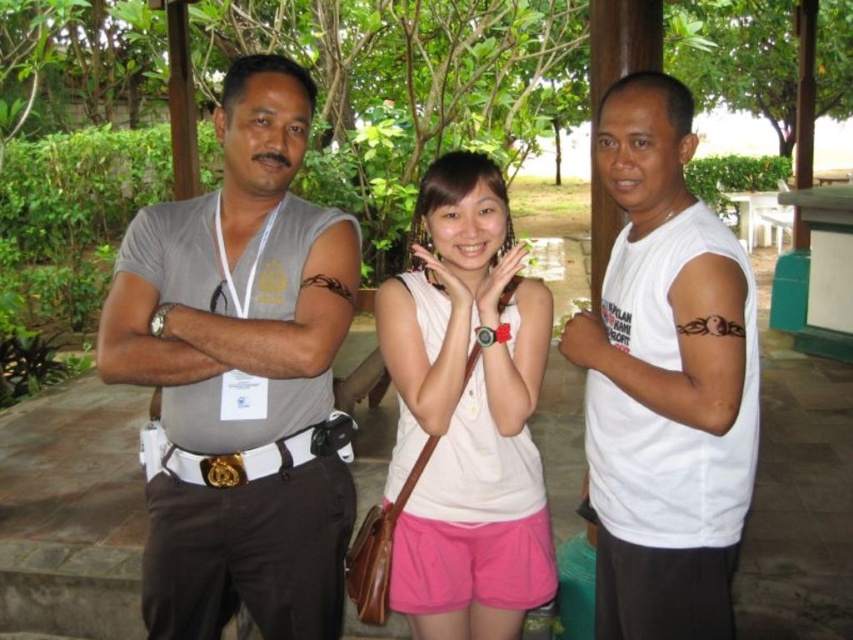
Find the location of a particular element. The width and height of the screenshot is (853, 640). gray matte t-shirt at left is located at coordinates (241, 372).

Is gray matte t-shirt at left in front of white matte t-shirt at center?

No.

Does point (303, 468) come behind point (659, 456)?

Yes, it is behind point (659, 456).

Locate an element on the screen. gray matte t-shirt at left is located at coordinates (241, 372).

Does white matte t-shirt at center appear under white matte tank top at center?

No, white matte t-shirt at center is not below white matte tank top at center.

Can you confirm if white matte t-shirt at center is wider than white matte tank top at center?

No.

This screenshot has width=853, height=640. Describe the element at coordinates (665, 381) in the screenshot. I see `white matte t-shirt at center` at that location.

Where is `white matte t-shirt at center`? The width and height of the screenshot is (853, 640). white matte t-shirt at center is located at coordinates (665, 381).

Can you confirm if gray matte t-shirt at left is wider than white matte tank top at center?

Indeed, gray matte t-shirt at left has a greater width compared to white matte tank top at center.

Who is more forward, (334, 605) or (519, 458)?

Positioned in front is point (334, 605).

Locate an element on the screen. The height and width of the screenshot is (640, 853). gray matte t-shirt at left is located at coordinates (241, 372).